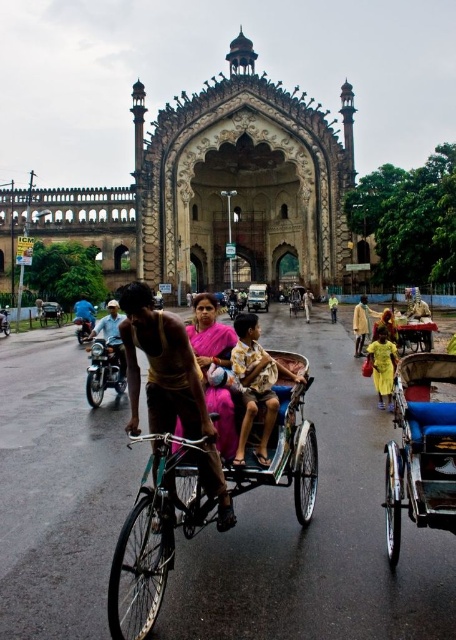
You are a tourist standing in front of the grand historical gateway. You see a shiny gold bicycle at center and a shiny metallic motorcycle at center. Which one is positioned to the right?

The shiny gold bicycle at center is positioned to the right of the shiny metallic motorcycle at center.

You are a delivery person who needs to choose between the green metallic bicycle at center and the shiny metallic motorcycle at left for a delivery job that requires carrying packages taller than 1.5 meters. Which vehicle would allow you to carry taller packages?

The green metallic bicycle at center is taller than the shiny metallic motorcycle at left, so it can accommodate packages taller than 1.5 meters.